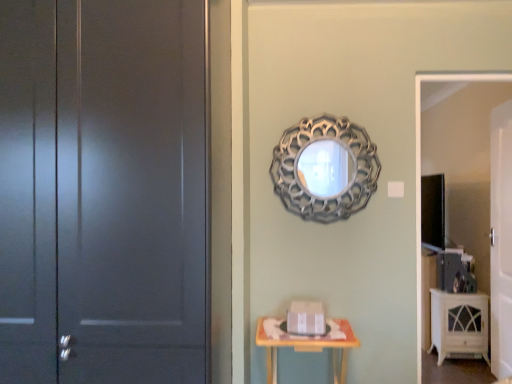
Locate an element on the screen. blank space above silver metallic mirror at upper center (from a real-world perspective) is located at coordinates (328, 110).